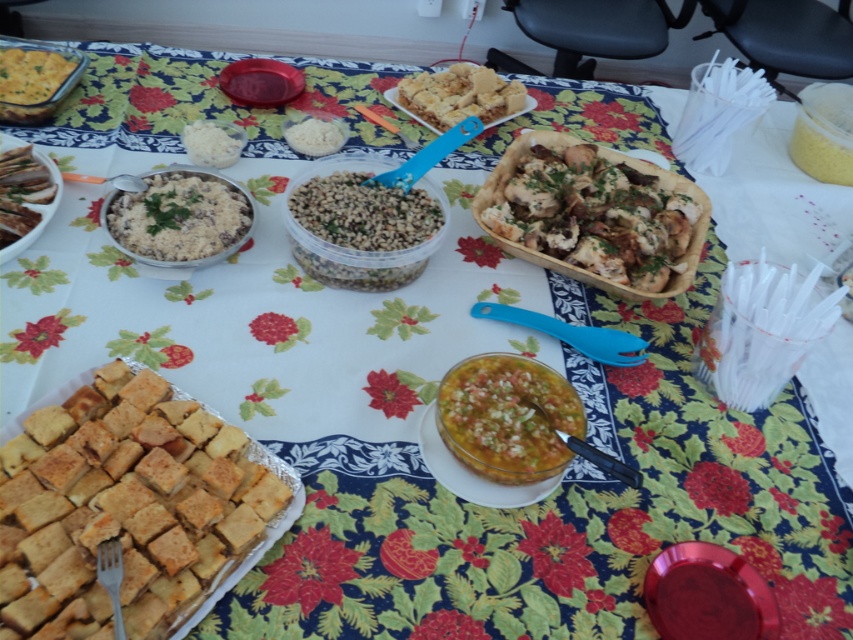
You are at a buffet table and want to know which item is taller between the brown matte meat at upper left and the white crumbly bread at center. Can you tell me which one is taller?

The brown matte meat at upper left is taller than the white crumbly bread at center according to the description.

You are at the table and want to reach for the yellowish translucent soup at center. Based on the coordinates provided, is the soup closer to the edge of the table or the center?

The yellowish translucent soup at center is located at point coordinates closer to the center of the table since its coordinates are given as the center point.